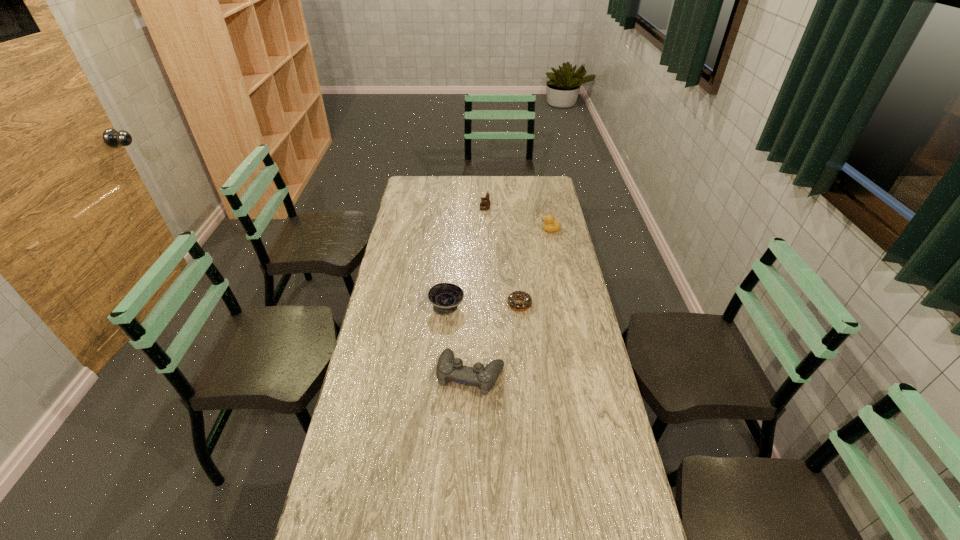
I want to click on free spot that satisfies the following two spatial constraints: 1. on the back side of the fourth object from left to right; 2. on the left side of the control, so click(x=472, y=304).

Locate an element on the screen. The image size is (960, 540). vacant area in the image that satisfies the following two spatial constraints: 1. on the face of the farthest object; 2. on the back side of the shortest object is located at coordinates (487, 304).